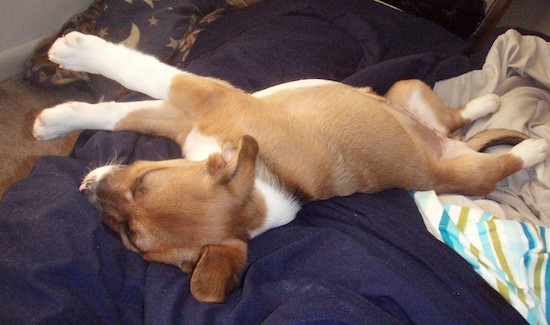
At what (x,y) coordinates should I click in order to perform the action: click on carpet. Please return your answer as a coordinate pair (x, y). This screenshot has width=550, height=325. Looking at the image, I should click on (13, 152).